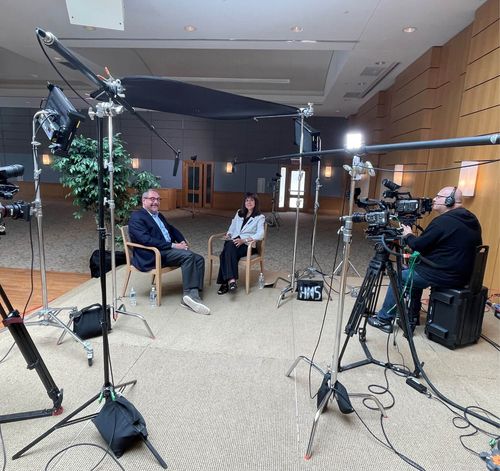
The width and height of the screenshot is (500, 471). Identify the location of circle lights in ceiling. (188, 30), (295, 27), (408, 31).